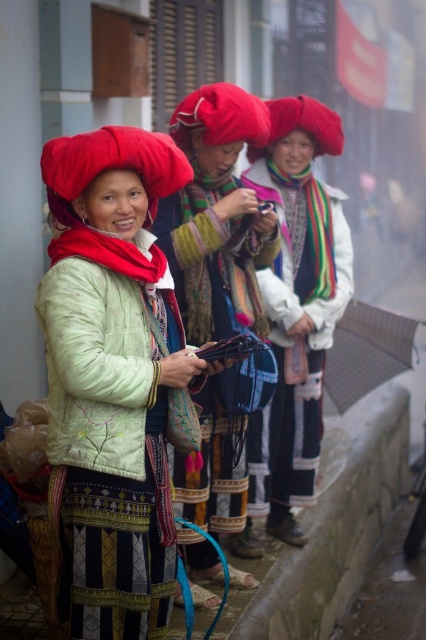
Does point (316, 253) come farther from viewer compared to point (192, 310)?

Yes, point (316, 253) is farther from viewer.

Based on the photo, is matte red hat at center further to camera compared to textured fabric scarf at center?

Yes, matte red hat at center is further from the viewer.

Is point (296, 470) closer to camera compared to point (195, 205)?

That is False.

Locate an element on the screen. matte red hat at center is located at coordinates click(x=294, y=312).

Does concrete curb at lower right have a lesser height compared to velvet-like red headdress at left?

In fact, concrete curb at lower right may be taller than velvet-like red headdress at left.

Does concrete curb at lower right lie behind velvet-like red headdress at left?

Yes, concrete curb at lower right is further from the viewer.

Image resolution: width=426 pixels, height=640 pixels. Identify the location of concrete curb at lower right. (336, 522).

Is matte green jacket at center taller than velvet-like red headdress at left?

Indeed, matte green jacket at center has a greater height compared to velvet-like red headdress at left.

The width and height of the screenshot is (426, 640). I want to click on matte green jacket at center, so click(114, 380).